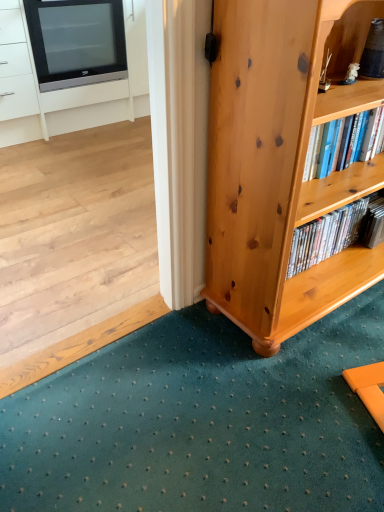
Question: From a real-world perspective, is matte black tv at upper left over black glossy television at upper left?

Choices:
 (A) yes
 (B) no

Answer: (B)

Question: Is matte black tv at upper left far away from black glossy television at upper left?

Choices:
 (A) no
 (B) yes

Answer: (A)

Question: From a real-world perspective, is matte black tv at upper left located beneath black glossy television at upper left?

Choices:
 (A) yes
 (B) no

Answer: (A)

Question: Could you tell me if matte black tv at upper left is turned towards black glossy television at upper left?

Choices:
 (A) yes
 (B) no

Answer: (A)

Question: Considering the relative sizes of matte black tv at upper left and black glossy television at upper left in the image provided, is matte black tv at upper left taller than black glossy television at upper left?

Choices:
 (A) yes
 (B) no

Answer: (A)

Question: Based on their sizes in the image, would you say light brown wood bookcase at lower right is bigger or smaller than teal carpet at lower center?

Choices:
 (A) big
 (B) small

Answer: (A)

Question: From a real-world perspective, relative to teal carpet at lower center, is light brown wood bookcase at lower right vertically above or below?

Choices:
 (A) below
 (B) above

Answer: (B)

Question: Is light brown wood bookcase at lower right inside the boundaries of teal carpet at lower center, or outside?

Choices:
 (A) outside
 (B) inside

Answer: (A)

Question: Looking at their shapes, would you say light brown wood bookcase at lower right is wider or thinner than teal carpet at lower center?

Choices:
 (A) thin
 (B) wide

Answer: (A)

Question: From the image's perspective, is teal carpet at lower center positioned above or below light brown wood bookcase at lower right?

Choices:
 (A) above
 (B) below

Answer: (B)

Question: Is teal carpet at lower center to the left or to the right of light brown wood bookcase at lower right in the image?

Choices:
 (A) left
 (B) right

Answer: (A)

Question: In terms of width, does teal carpet at lower center look wider or thinner when compared to light brown wood bookcase at lower right?

Choices:
 (A) thin
 (B) wide

Answer: (B)

Question: Does point (259, 482) appear closer or farther from the camera than point (251, 12)?

Choices:
 (A) farther
 (B) closer

Answer: (A)

Question: From a real-world perspective, is black glossy television at upper left above or below matte black tv at upper left?

Choices:
 (A) below
 (B) above

Answer: (B)

Question: Is point (67, 80) positioned closer to the camera than point (3, 105)?

Choices:
 (A) closer
 (B) farther

Answer: (B)